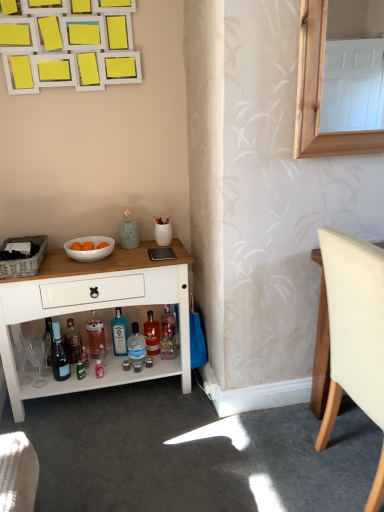
Question: Is translucent glass bottle at lower center, which is the fifth bottle from left to right, closer to camera compared to white wood cabinet at lower left?

Choices:
 (A) yes
 (B) no

Answer: (B)

Question: Does translucent glass bottle at lower center, which is the fifth bottle from left to right, appear on the right side of white wood cabinet at lower left?

Choices:
 (A) no
 (B) yes

Answer: (B)

Question: Considering the relative sizes of translucent glass bottle at lower center, which is the fifth bottle from left to right, and white wood cabinet at lower left in the image provided, is translucent glass bottle at lower center, which is the fifth bottle from left to right, thinner than white wood cabinet at lower left?

Choices:
 (A) yes
 (B) no

Answer: (A)

Question: Does translucent glass bottle at lower center, the first bottle in the right-to-left sequence, have a greater width compared to white wood cabinet at lower left?

Choices:
 (A) yes
 (B) no

Answer: (B)

Question: Is translucent glass bottle at lower center, which is the fifth bottle from left to right, positioned with its back to white wood cabinet at lower left?

Choices:
 (A) yes
 (B) no

Answer: (A)

Question: Does translucent glass bottle at lower center, the first bottle in the right-to-left sequence, have a lesser height compared to white wood cabinet at lower left?

Choices:
 (A) yes
 (B) no

Answer: (A)

Question: Would you say matte black picnic basket at left is outside shiny dark glass bottle at lower left, arranged as the 5th bottle when viewed from the right?

Choices:
 (A) no
 (B) yes

Answer: (B)

Question: From the image's perspective, is matte black picnic basket at left under shiny dark glass bottle at lower left, arranged as the 5th bottle when viewed from the right?

Choices:
 (A) yes
 (B) no

Answer: (B)

Question: Considering the relative sizes of matte black picnic basket at left and shiny dark glass bottle at lower left, arranged as the 5th bottle when viewed from the right, in the image provided, is matte black picnic basket at left shorter than shiny dark glass bottle at lower left, arranged as the 5th bottle when viewed from the right,?

Choices:
 (A) yes
 (B) no

Answer: (A)

Question: Can you confirm if matte black picnic basket at left is thinner than shiny dark glass bottle at lower left, arranged as the 5th bottle when viewed from the right?

Choices:
 (A) no
 (B) yes

Answer: (A)

Question: From a real-world perspective, is matte black picnic basket at left physically above shiny dark glass bottle at lower left, arranged as the 5th bottle when viewed from the right?

Choices:
 (A) no
 (B) yes

Answer: (B)

Question: Considering the relative sizes of matte black picnic basket at left and shiny dark glass bottle at lower left, placed as the 1th bottle when sorted from left to right, in the image provided, is matte black picnic basket at left wider than shiny dark glass bottle at lower left, placed as the 1th bottle when sorted from left to right,?

Choices:
 (A) no
 (B) yes

Answer: (B)

Question: Is the surface of translucent plastic bottle at lower center, which is the 2th bottle in left-to-right order, in direct contact with clear plastic bottle at lower center, the 4th bottle in the left-to-right sequence?

Choices:
 (A) yes
 (B) no

Answer: (B)